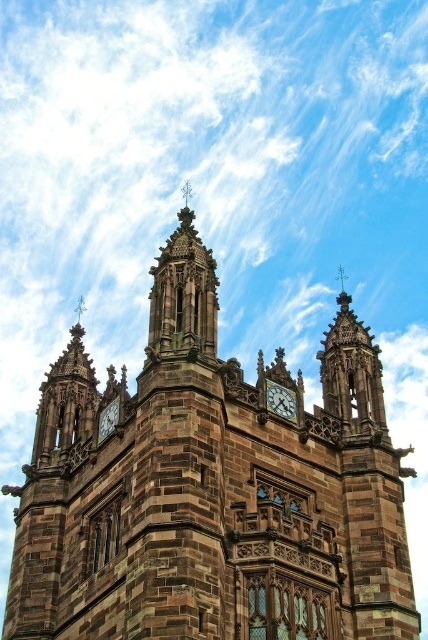
Between brown stone church at center and polished stone clock at center, which one has less height?

With less height is polished stone clock at center.

Based on the photo, can you confirm if brown stone church at center is bigger than polished stone clock at center?

Indeed, brown stone church at center has a larger size compared to polished stone clock at center.

Where is `brown stone church at center`? This screenshot has height=640, width=428. brown stone church at center is located at coordinates (211, 488).

Locate an element on the screen. The width and height of the screenshot is (428, 640). brown stone church at center is located at coordinates (211, 488).

Which is more to the left, brown stone church at center or matte brown clock at center?

From the viewer's perspective, matte brown clock at center appears more on the left side.

Is point (235, 492) closer to camera compared to point (103, 429)?

Yes, point (235, 492) is closer to viewer.

Is point (196, 316) closer to camera compared to point (109, 429)?

Yes, point (196, 316) is closer to viewer.

The height and width of the screenshot is (640, 428). In order to click on brown stone church at center in this screenshot , I will do `click(211, 488)`.

Which of these two, polished stone clock at center or matte brown clock at center, stands taller?

With more height is polished stone clock at center.

Does polished stone clock at center have a greater height compared to matte brown clock at center?

Yes.

Is point (275, 406) closer to camera compared to point (109, 416)?

Yes.

The image size is (428, 640). What are the coordinates of `polished stone clock at center` in the screenshot? It's located at (281, 401).